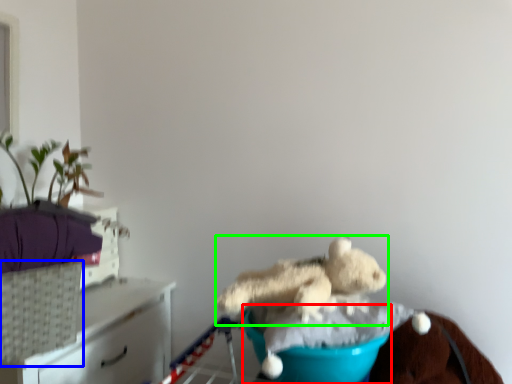
Question: Estimate the real-world distances between objects in this image. Which object is farther from teal (highlighted by a red box), basket (highlighted by a blue box) or teddy bear (highlighted by a green box)?

Choices:
 (A) basket
 (B) teddy bear

Answer: (A)